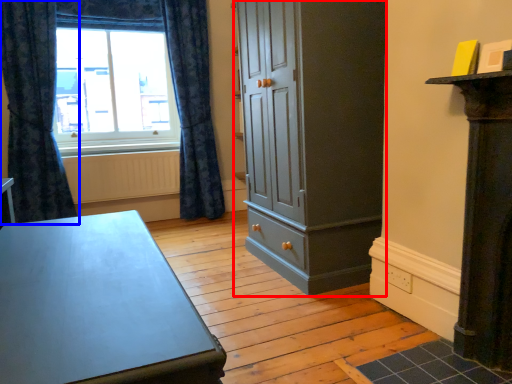
Question: Which object is further to the camera taking this photo, cupboard (highlighted by a red box) or curtain (highlighted by a blue box)?

Choices:
 (A) cupboard
 (B) curtain

Answer: (B)